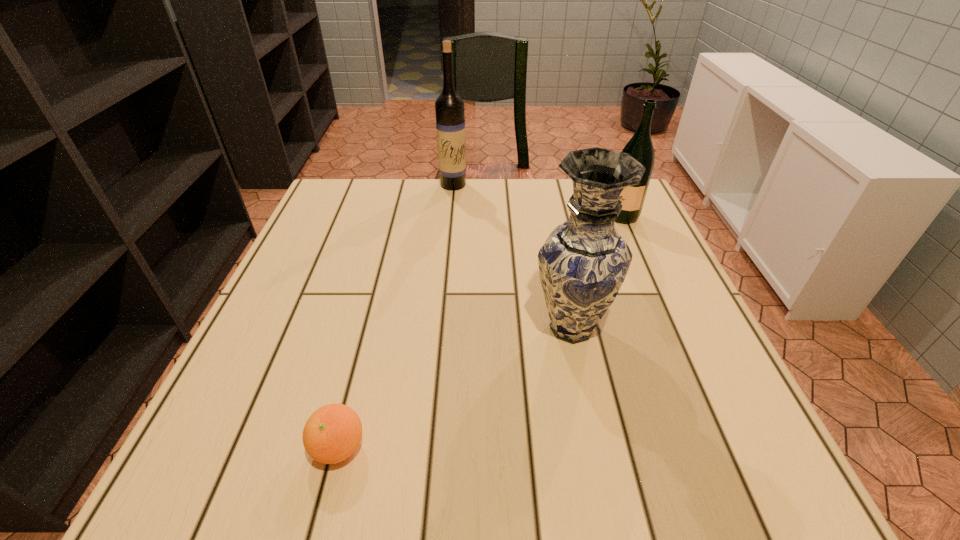
The width and height of the screenshot is (960, 540). I want to click on blank area located 0.080m on the surface of the second shortest object, so click(x=564, y=218).

Identify the location of free spot located 0.120m on the surface of the second shortest object. (548, 218).

Locate an element on the screen. This screenshot has width=960, height=540. free space located on the surface of the second shortest object is located at coordinates (552, 218).

At what (x,y) coordinates should I click in order to perform the action: click on free space located on the right of the leftmost object. Please return your answer as a coordinate pair (x, y). The width and height of the screenshot is (960, 540). Looking at the image, I should click on (496, 447).

Identify the location of object that is at the near edge. This screenshot has width=960, height=540. (332, 433).

The image size is (960, 540). Find the location of `object located in the right edge section of the desktop`. object located in the right edge section of the desktop is located at coordinates (640, 147).

Identify the location of object that is positioned at the far right corner. The width and height of the screenshot is (960, 540). pos(640,147).

The image size is (960, 540). What are the coordinates of `free location at the far edge of the desktop` in the screenshot? It's located at (412, 179).

In order to click on vacant region at the left edge of the desktop in this screenshot , I will do `click(270, 336)`.

I want to click on vacant space at the right edge, so click(x=679, y=434).